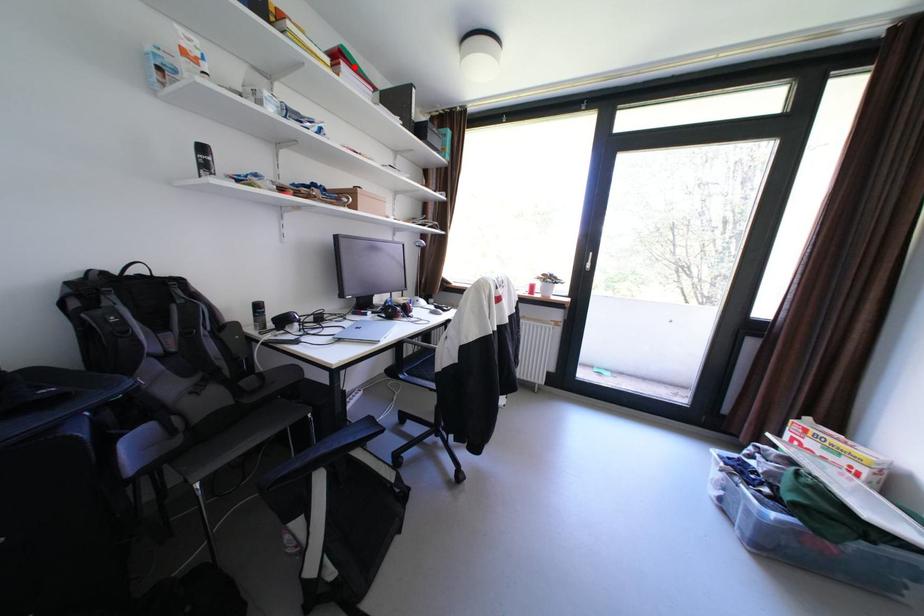
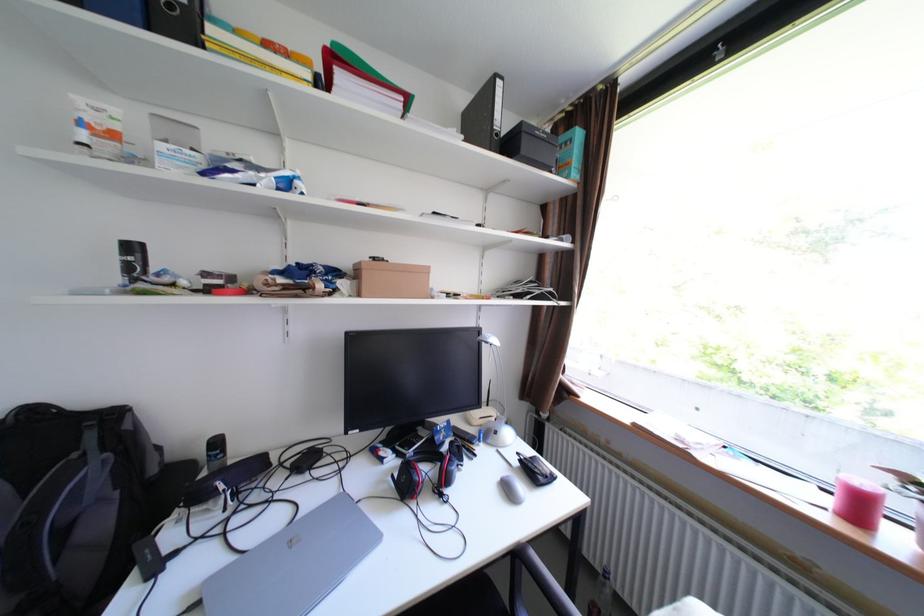
Where in the second image is the point corresponding to the highlighted location from the first image?

(351, 76)